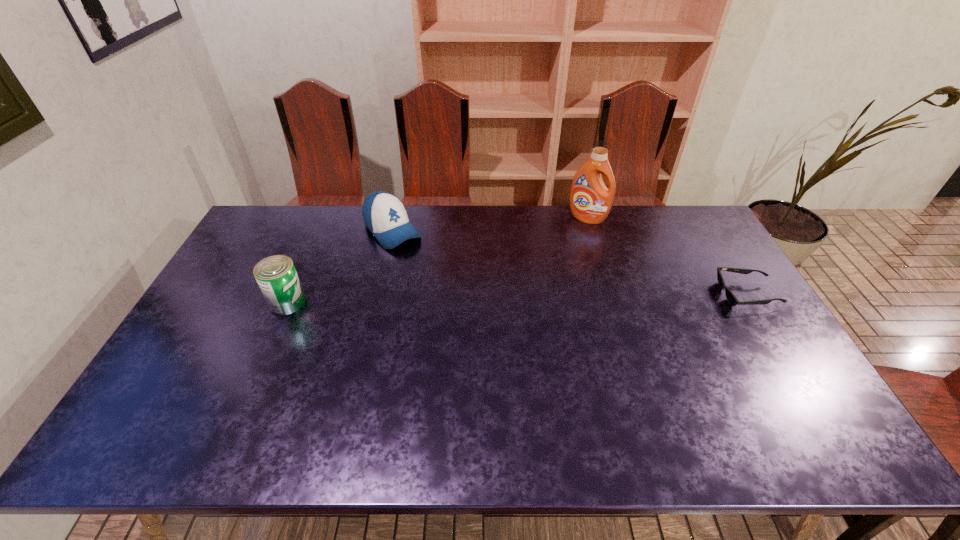
The image size is (960, 540). In order to click on can in this screenshot , I will do `click(276, 275)`.

Identify the location of the shortest object. The image size is (960, 540). (733, 301).

At what (x,y) coordinates should I click in order to perform the action: click on sunglasses. Please return your answer as a coordinate pair (x, y). This screenshot has height=540, width=960. Looking at the image, I should click on (733, 301).

Find the location of a particular element. The height and width of the screenshot is (540, 960). baseball cap is located at coordinates (384, 215).

In order to click on the third object from left to right in this screenshot , I will do `click(590, 200)`.

Locate an element on the screen. the tallest object is located at coordinates (590, 200).

Find the location of a particular element. This screenshot has width=960, height=540. free spot located on the front of the leftmost object is located at coordinates (266, 351).

At what (x,y) coordinates should I click in order to perform the action: click on vacant space located 0.080m on the front-facing side of the rightmost object. Please return your answer as a coordinate pair (x, y). This screenshot has height=540, width=960. Looking at the image, I should click on pyautogui.click(x=693, y=294).

Image resolution: width=960 pixels, height=540 pixels. Identify the location of vacant space located on the front-facing side of the rightmost object. click(x=648, y=294).

This screenshot has width=960, height=540. I want to click on free space located 0.380m on the front-facing side of the rightmost object, so click(x=595, y=294).